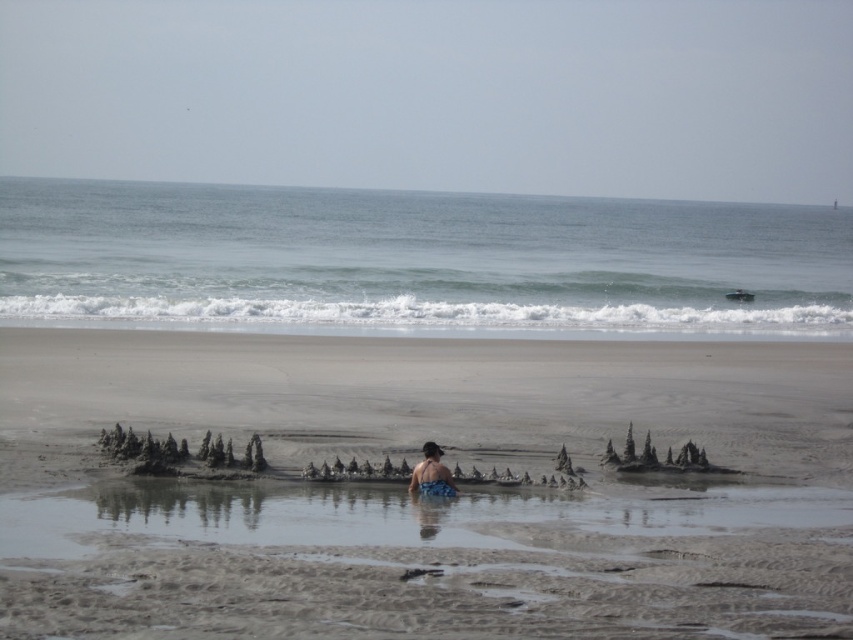
Does blue water at center appear on the right side of blue textured swimsuit at center?

Indeed, blue water at center is positioned on the right side of blue textured swimsuit at center.

Is blue water at center below blue textured swimsuit at center?

Actually, blue water at center is above blue textured swimsuit at center.

Between point (262, 234) and point (419, 477), which one is positioned behind?

Positioned behind is point (262, 234).

Identify the location of blue water at center. The image size is (853, 640). (416, 260).

Does sandy beach at center appear over blue textured swimsuit at center?

Correct, sandy beach at center is located above blue textured swimsuit at center.

Can you confirm if sandy beach at center is positioned to the left of blue textured swimsuit at center?

Yes, sandy beach at center is to the left of blue textured swimsuit at center.

Who is more distant from viewer, (434, 362) or (439, 477)?

Point (434, 362)

Locate an element on the screen. This screenshot has height=640, width=853. sandy beach at center is located at coordinates [x=418, y=500].

Is sandy beach at center taller than blue water at center?

In fact, sandy beach at center may be shorter than blue water at center.

Is sandy beach at center above blue water at center?

No.

Between point (596, 602) and point (686, 292), which one is positioned in front?

Point (596, 602) is in front.

Identify the location of sandy beach at center. This screenshot has height=640, width=853. (418, 500).